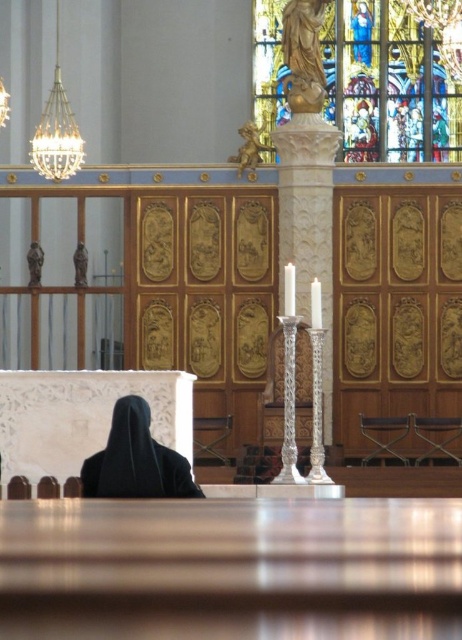
Is stained glass window at upper center taller than white porcelain candle at center?

Correct, stained glass window at upper center is much taller as white porcelain candle at center.

Can you confirm if stained glass window at upper center is wider than white porcelain candle at center?

Yes, stained glass window at upper center is wider than white porcelain candle at center.

Does point (432, 120) lie in front of point (291, 296)?

That is False.

The image size is (462, 640). Identify the location of stained glass window at upper center. (388, 84).

Which is below, gold polished statue at upper center or white glossy candle at center?

white glossy candle at center

Which is in front, point (291, 35) or point (320, 323)?

Point (320, 323) is more forward.

Where is `gold polished statue at upper center`? The image size is (462, 640). gold polished statue at upper center is located at coordinates [x=303, y=54].

Is stained glass window at upper center in front of gold polished statue at upper center?

No.

Is stained glass window at upper center wider than gold polished statue at upper center?

Indeed, stained glass window at upper center has a greater width compared to gold polished statue at upper center.

What do you see at coordinates (388, 84) in the screenshot?
I see `stained glass window at upper center` at bounding box center [388, 84].

Where is `stained glass window at upper center`? Image resolution: width=462 pixels, height=640 pixels. stained glass window at upper center is located at coordinates (388, 84).